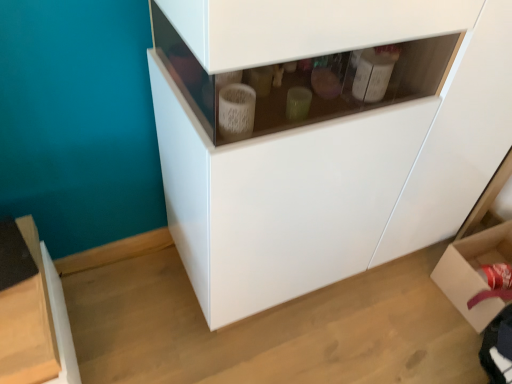
Measure the distance between point (430, 186) and camera.

Point (430, 186) is 4.07 feet away from camera.

This screenshot has width=512, height=384. What are the coordinates of `white glossy cabinet at center` in the screenshot? It's located at (322, 135).

The width and height of the screenshot is (512, 384). Describe the element at coordinates (322, 135) in the screenshot. I see `white glossy cabinet at center` at that location.

The width and height of the screenshot is (512, 384). I want to click on cardboard box at lower right, so click(474, 272).

The image size is (512, 384). What do you see at coordinates (474, 272) in the screenshot?
I see `cardboard box at lower right` at bounding box center [474, 272].

I want to click on white glossy cabinet at center, so click(x=322, y=135).

Is cardboard box at lower right to the left of white glossy cabinet at center from the viewer's perspective?

Incorrect, cardboard box at lower right is not on the left side of white glossy cabinet at center.

Is cardboard box at lower right in front of or behind white glossy cabinet at center in the image?

Clearly, cardboard box at lower right is behind white glossy cabinet at center.

Is point (462, 295) closer or farther from the camera than point (207, 113)?

Point (462, 295) is farther from the camera than point (207, 113).

From the image's perspective, relative to white glossy cabinet at center, is cardboard box at lower right above or below?

Clearly, from the image's perspective, cardboard box at lower right is below white glossy cabinet at center.

From a real-world perspective, is cardboard box at lower right physically located above or below white glossy cabinet at center?

Clearly, from a real-world perspective, cardboard box at lower right is below white glossy cabinet at center.

Which object is wider, cardboard box at lower right or white glossy cabinet at center?

With larger width is white glossy cabinet at center.

Looking at this image, considering the relative sizes of cardboard box at lower right and white glossy cabinet at center in the image provided, is cardboard box at lower right shorter than white glossy cabinet at center?

Indeed, cardboard box at lower right has a lesser height compared to white glossy cabinet at center.

Is cardboard box at lower right smaller than white glossy cabinet at center?

Yes.

Is cardboard box at lower right located outside white glossy cabinet at center?

Yes.

Does cardboard box at lower right touch white glossy cabinet at center?

There is a gap between cardboard box at lower right and white glossy cabinet at center.

Is cardboard box at lower right oriented away from white glossy cabinet at center?

cardboard box at lower right does not have its back to white glossy cabinet at center.

How many degrees apart are the facing directions of cardboard box at lower right and white glossy cabinet at center?

The angular difference between cardboard box at lower right and white glossy cabinet at center is 88.4 degrees.

How much distance is there between cardboard box at lower right and white glossy cabinet at center?

The distance of cardboard box at lower right from white glossy cabinet at center is 23.13 inches.

Find the location of a particular element. The image size is (512, 384). cabinetry on the left of cardboard box at lower right is located at coordinates (322, 135).

Can you confirm if white glossy cabinet at center is positioned to the right of cardboard box at lower right?

No.

Which object is closer to the camera taking this photo, white glossy cabinet at center or cardboard box at lower right?

Positioned in front is white glossy cabinet at center.

Considering the positions of point (191, 267) and point (496, 248), is point (191, 267) closer or farther from the camera than point (496, 248)?

Point (191, 267) is positioned closer to the camera compared to point (496, 248).

From the image's perspective, who appears lower, white glossy cabinet at center or cardboard box at lower right?

cardboard box at lower right.

From a real-world perspective, is white glossy cabinet at center on top of cardboard box at lower right?

Correct, in the physical world, white glossy cabinet at center is higher than cardboard box at lower right.

Considering the sizes of objects white glossy cabinet at center and cardboard box at lower right in the image provided, who is thinner, white glossy cabinet at center or cardboard box at lower right?

cardboard box at lower right.

Is white glossy cabinet at center shorter than cardboard box at lower right?

No, white glossy cabinet at center is not shorter than cardboard box at lower right.

Considering the sizes of objects white glossy cabinet at center and cardboard box at lower right in the image provided, who is bigger, white glossy cabinet at center or cardboard box at lower right?

Bigger between the two is white glossy cabinet at center.

Is white glossy cabinet at center not inside cardboard box at lower right?

Yes, white glossy cabinet at center is not within cardboard box at lower right.

Is white glossy cabinet at center not close to cardboard box at lower right?

white glossy cabinet at center is actually quite close to cardboard box at lower right.

Is white glossy cabinet at center turned away from cardboard box at lower right?

white glossy cabinet at center is not turned away from cardboard box at lower right.

Find the location of a particular element. Image resolution: width=512 pixels, height=384 pixels. cabinetry located in front of the cardboard box at lower right is located at coordinates (322, 135).

In order to click on cardboard box located underneath the white glossy cabinet at center (from a real-world perspective) in this screenshot , I will do tap(474, 272).

Locate an element on the screen. cardboard box behind the white glossy cabinet at center is located at coordinates (474, 272).